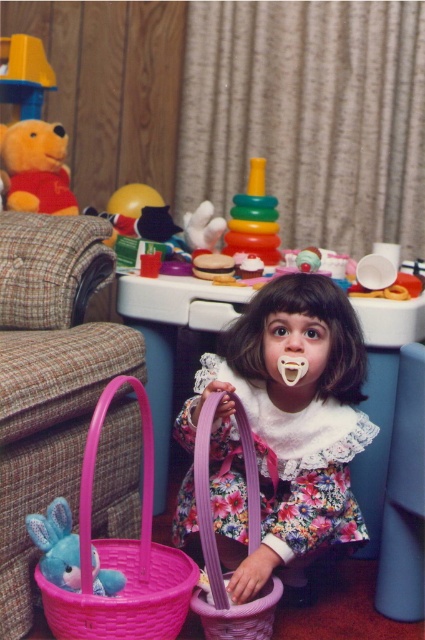
In the scene shown: Can you confirm if floral fabric dress at center is thinner than brown plaid armchair at left?

Incorrect, floral fabric dress at center's width is not less than brown plaid armchair at left's.

Between point (207, 372) and point (124, 429), which one is positioned in front?

Positioned in front is point (207, 372).

Is point (306, 339) positioned in front of point (62, 410)?

No, it is not.

At what (x,y) coordinates should I click in order to perform the action: click on floral fabric dress at center. Please return your answer as a coordinate pair (x, y). The height and width of the screenshot is (640, 425). Looking at the image, I should click on (286, 428).

Is floral fabric dress at center to the right of pink wicker basket at lower left from the viewer's perspective?

Yes, floral fabric dress at center is to the right of pink wicker basket at lower left.

The width and height of the screenshot is (425, 640). I want to click on floral fabric dress at center, so click(x=286, y=428).

Does soft plush bear at upper left have a greater width compared to multicolored plastic stacking rings at center?

Yes.

Who is shorter, soft plush bear at upper left or multicolored plastic stacking rings at center?

soft plush bear at upper left

What do you see at coordinates (36, 168) in the screenshot? I see `soft plush bear at upper left` at bounding box center [36, 168].

Find the location of a particular element. The height and width of the screenshot is (640, 425). soft plush bear at upper left is located at coordinates pos(36,168).